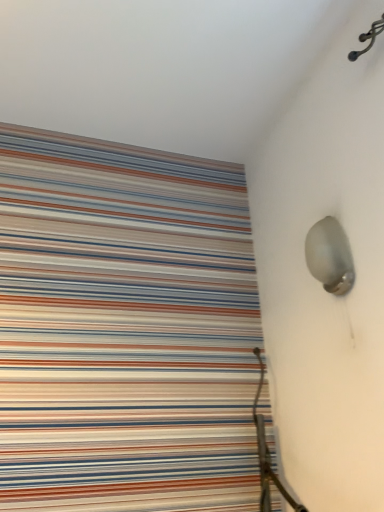
Describe the element at coordinates (330, 256) in the screenshot. I see `satin silver lamp at upper right` at that location.

Locate an element on the screen. This screenshot has width=384, height=512. satin silver lamp at upper right is located at coordinates tap(330, 256).

In order to face satin silver lamp at upper right, should I rotate leftwards or rightwards?

A 17.192 degree turn to the right will do.

Where is `satin silver lamp at upper right`? Image resolution: width=384 pixels, height=512 pixels. satin silver lamp at upper right is located at coordinates (330, 256).